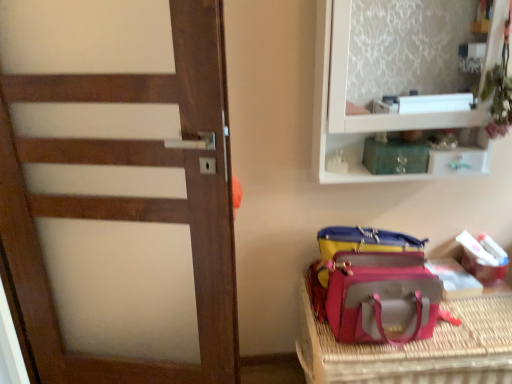
Question: Is point (399, 142) positioned closer to the camera than point (481, 281)?

Choices:
 (A) farther
 (B) closer

Answer: (B)

Question: Considering the positions of green glass jar at upper center, the 1th kit in the top-to-bottom sequence, and white cardboard box at lower right, which appears as the second kit when viewed from the left, in the image, is green glass jar at upper center, the 1th kit in the top-to-bottom sequence, taller or shorter than white cardboard box at lower right, which appears as the second kit when viewed from the left,?

Choices:
 (A) short
 (B) tall

Answer: (B)

Question: Which of these objects is positioned farthest from the metallic green drawer at upper right?

Choices:
 (A) white glossy cabinet at upper right
 (B) white cardboard box at lower right, marked as the second kit in a front-to-back arrangement
 (C) wooden door at left
 (D) pink fabric bag at lower right
 (E) green glass jar at upper center, the 2th kit when ordered from right to left

Answer: (C)

Question: Considering the real-world distances, which object is farthest from the pink fabric bag at lower right?

Choices:
 (A) leatherette pet carrier at lower right
 (B) white glossy cabinet at upper right
 (C) white cardboard box at lower right, which is the 1th kit in right-to-left order
 (D) wooden door at left
 (E) metallic green drawer at upper right

Answer: (D)